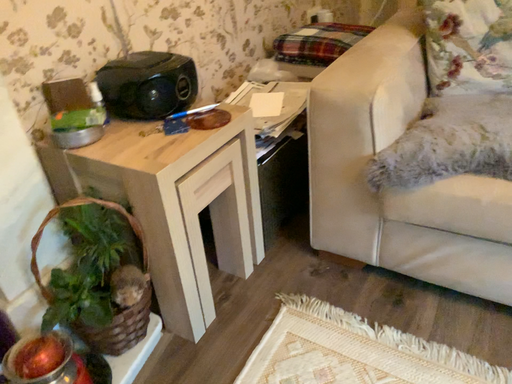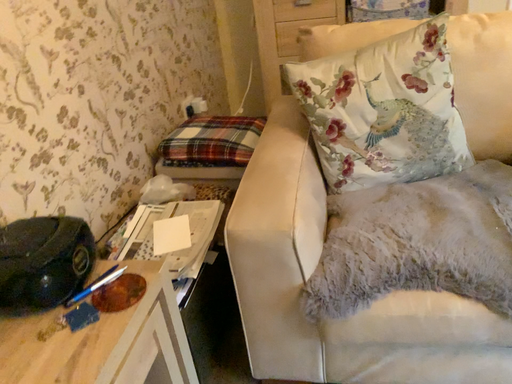
Question: How did the camera likely rotate when shooting the video?

Choices:
 (A) rotated right
 (B) rotated left

Answer: (A)